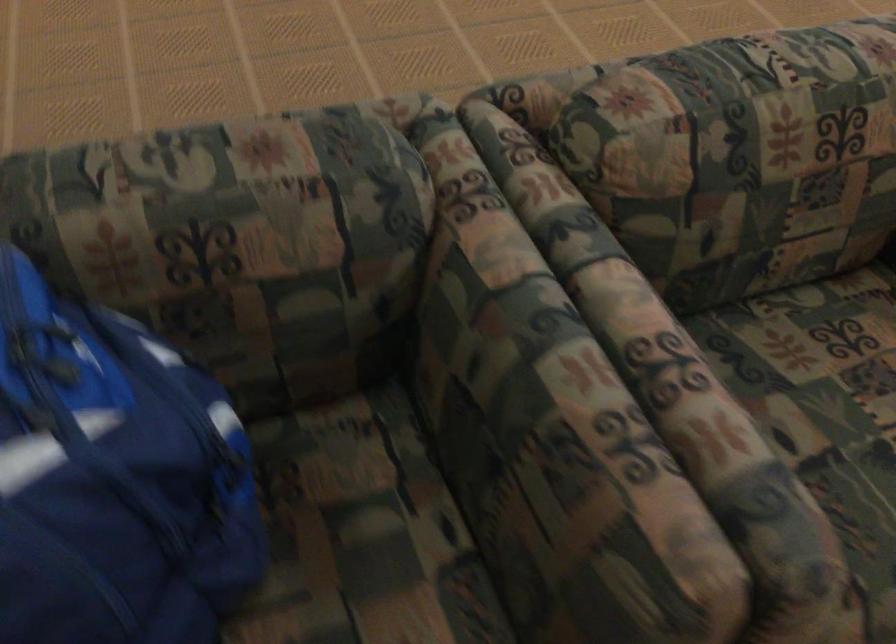
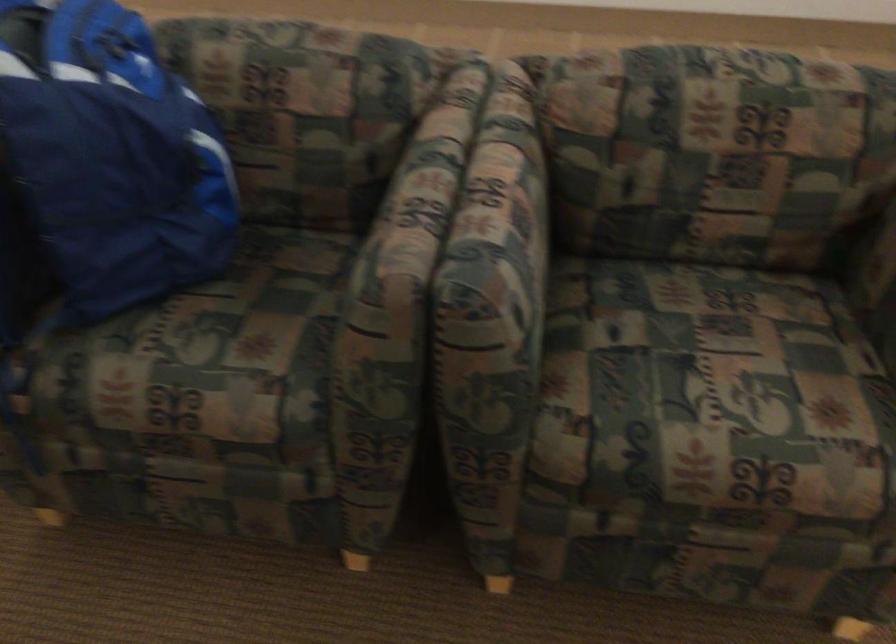
Locate, in the second image, the point that corresponds to pixel 625 440 in the first image.

(412, 207)